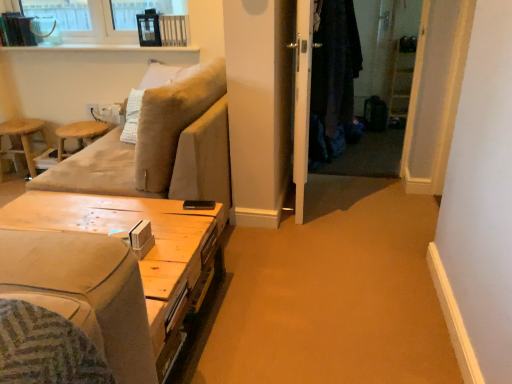
Question: From a real-world perspective, is woodenmaterial/texturetable at lower left physically located above or below white glossy screen door at center?

Choices:
 (A) above
 (B) below

Answer: (B)

Question: In the image, is woodenmaterial/texturetable at lower left positioned in front of or behind white glossy screen door at center?

Choices:
 (A) front
 (B) behind

Answer: (A)

Question: Which is farther from the white glossy screen door at center?

Choices:
 (A) wooden stool at left, acting as the second bar stool starting from the right
 (B) beige fabric couch at left
 (C) wooden bar stool at left, which is the 1th bar stool from right to left
 (D) woodenmaterial/texturetable at lower left
 (E) dark woolen robe at center

Answer: (A)

Question: Estimate the real-world distances between objects in this image. Which object is farther from the white glossy screen door at center?

Choices:
 (A) woodenmaterial/texturetable at lower left
 (B) wooden stool at left, arranged as the 1th bar stool when viewed from the left
 (C) dark woolen robe at center
 (D) beige fabric couch at left
 (E) wooden bar stool at left, which is the 1th bar stool from right to left

Answer: (B)